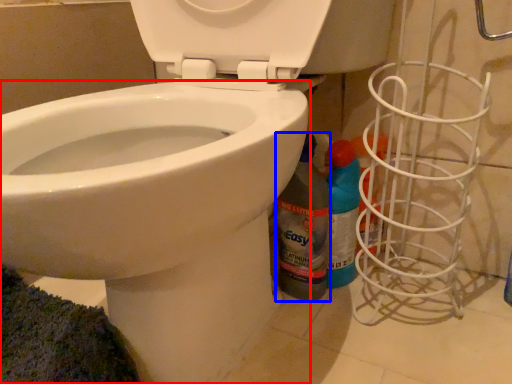
Question: Which object is closer to the camera taking this photo, bidet (highlighted by a red box) or cleaning product (highlighted by a blue box)?

Choices:
 (A) bidet
 (B) cleaning product

Answer: (A)